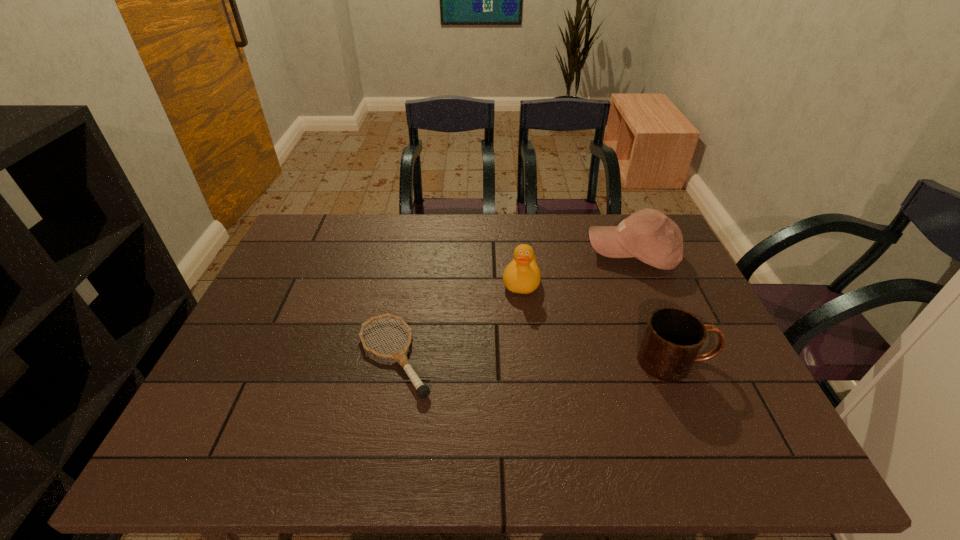
The height and width of the screenshot is (540, 960). Identify the location of free spot between the baseball cap and the mug. (655, 308).

Select which object appears as the closest to the mug. Please provide its 2D coordinates. Your answer should be formatted as a tuple, i.e. [(x, y)], where the tuple contains the x and y coordinates of a point satisfying the conditions above.

[(648, 235)]

Point out which object is positioned as the second nearest to the tennis racket. Please provide its 2D coordinates. Your answer should be formatted as a tuple, i.e. [(x, y)], where the tuple contains the x and y coordinates of a point satisfying the conditions above.

[(648, 235)]

The image size is (960, 540). In order to click on free location that satisfies the following two spatial constraints: 1. on the front side of the shortest object; 2. on the side of the mug with the handle in this screenshot , I will do `click(395, 361)`.

Image resolution: width=960 pixels, height=540 pixels. Find the location of `vacant space that satisfies the following two spatial constraints: 1. on the front side of the mug; 2. on the side of the tennis racket with the handle`. vacant space that satisfies the following two spatial constraints: 1. on the front side of the mug; 2. on the side of the tennis racket with the handle is located at coordinates (395, 361).

Where is `vacant space that satisfies the following two spatial constraints: 1. on the front side of the duck; 2. on the side of the mug with the handle`? The image size is (960, 540). vacant space that satisfies the following two spatial constraints: 1. on the front side of the duck; 2. on the side of the mug with the handle is located at coordinates (529, 361).

Locate an element on the screen. The height and width of the screenshot is (540, 960). vacant space that satisfies the following two spatial constraints: 1. on the front side of the baseball cap; 2. on the side of the mug with the handle is located at coordinates (677, 361).

In order to click on free space in the image that satisfies the following two spatial constraints: 1. on the front side of the mug; 2. on the side of the tennis racket with the handle in this screenshot , I will do `click(395, 361)`.

Where is `free spot that satisfies the following two spatial constraints: 1. on the front side of the mug; 2. on the side of the baseball cap with the handle`? This screenshot has width=960, height=540. free spot that satisfies the following two spatial constraints: 1. on the front side of the mug; 2. on the side of the baseball cap with the handle is located at coordinates (677, 361).

Image resolution: width=960 pixels, height=540 pixels. Find the location of `vacant area in the image that satisfies the following two spatial constraints: 1. on the back side of the shortest object; 2. on the left side of the baseball cap`. vacant area in the image that satisfies the following two spatial constraints: 1. on the back side of the shortest object; 2. on the left side of the baseball cap is located at coordinates (414, 254).